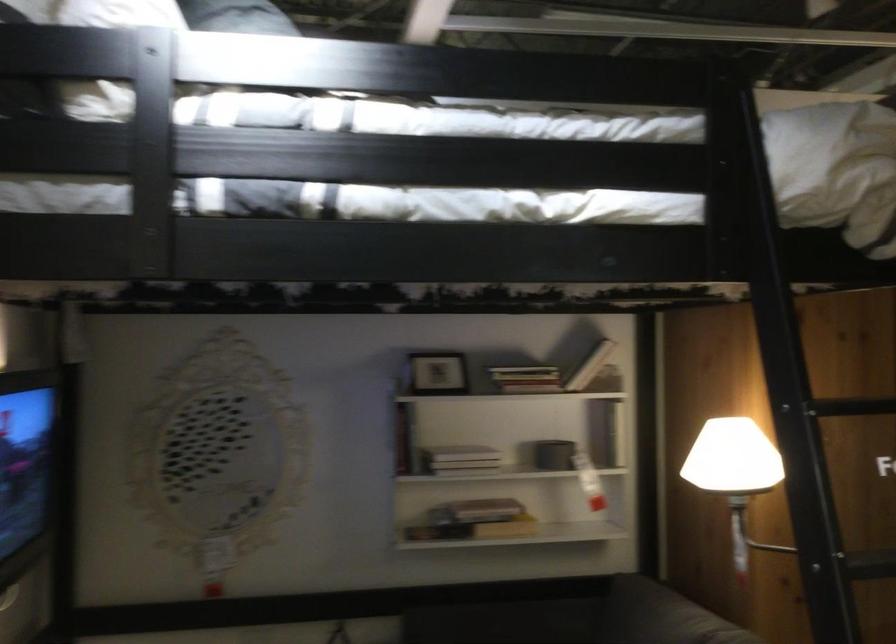
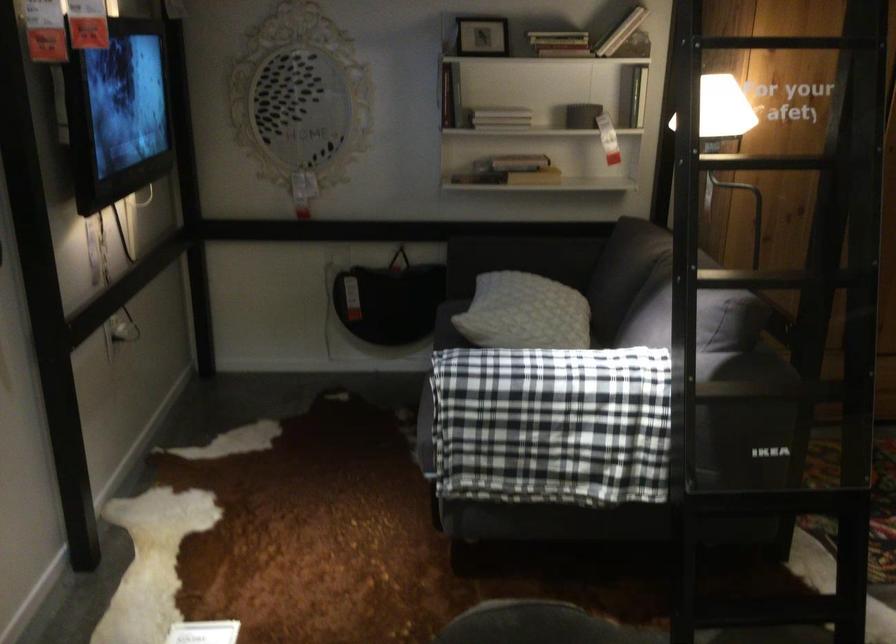
In the second image, find the point that corresponds to point 531,390 in the first image.

(558, 43)